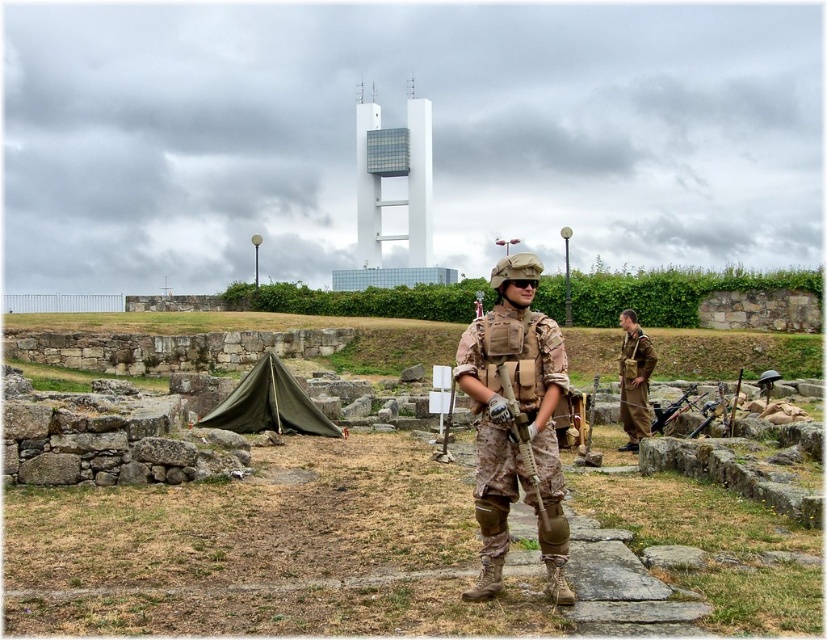
Question: Which of these objects is positioned farthest from the brown fabric uniform at right?

Choices:
 (A) matte black rifle at center
 (B) camouflage fabric rifle at center

Answer: (B)

Question: Is camouflage fabric rifle at center below matte black rifle at center?

Choices:
 (A) no
 (B) yes

Answer: (A)

Question: Estimate the real-world distances between objects in this image. Which object is farther from the matte black rifle at center?

Choices:
 (A) brown fabric uniform at right
 (B) camouflage fabric uniform at center

Answer: (B)

Question: Considering the relative positions of camouflage fabric uniform at center and matte black rifle at center in the image provided, where is camouflage fabric uniform at center located with respect to matte black rifle at center?

Choices:
 (A) left
 (B) right

Answer: (A)

Question: Estimate the real-world distances between objects in this image. Which object is farther from the camouflage fabric rifle at center?

Choices:
 (A) brown fabric uniform at right
 (B) matte black rifle at center

Answer: (B)

Question: Can you confirm if camouflage fabric uniform at center is wider than brown fabric uniform at right?

Choices:
 (A) yes
 (B) no

Answer: (B)